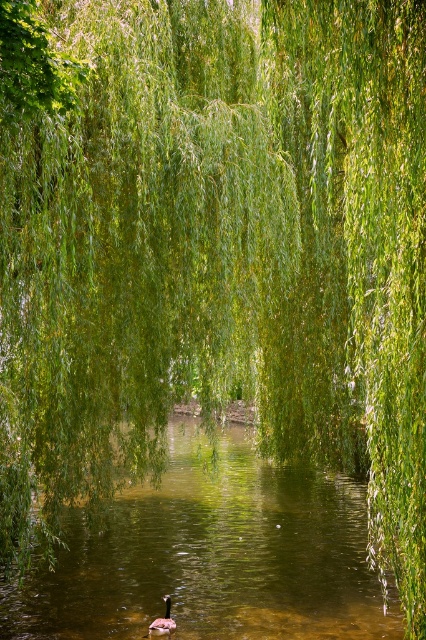
You are standing at the center of the weeping willow tree and want to observe two points in the scene. The first point is point (x=400, y=333) and the second is point (x=166, y=632). Which point will appear closer to you when looking from your current position?

Point (x=400, y=333) will appear closer because it is in front of point (x=166, y=632) from the viewer perspective.

You are standing at the origin point in the scene. Where is the green leafy river at center located in terms of 2D coordinates?

The green leafy river at center is located at coordinates 0.870 in the x axis and 0.500 in the y axis.

You are standing at the edge of the green leafy river at center and want to reach the brown fuzzy duck at center. What is the minimum distance you need to cross the river to reach the duck?

The green leafy river at center might be wider than brown fuzzy duck at center, so you need to cross the river at least the width of the duck to reach it.